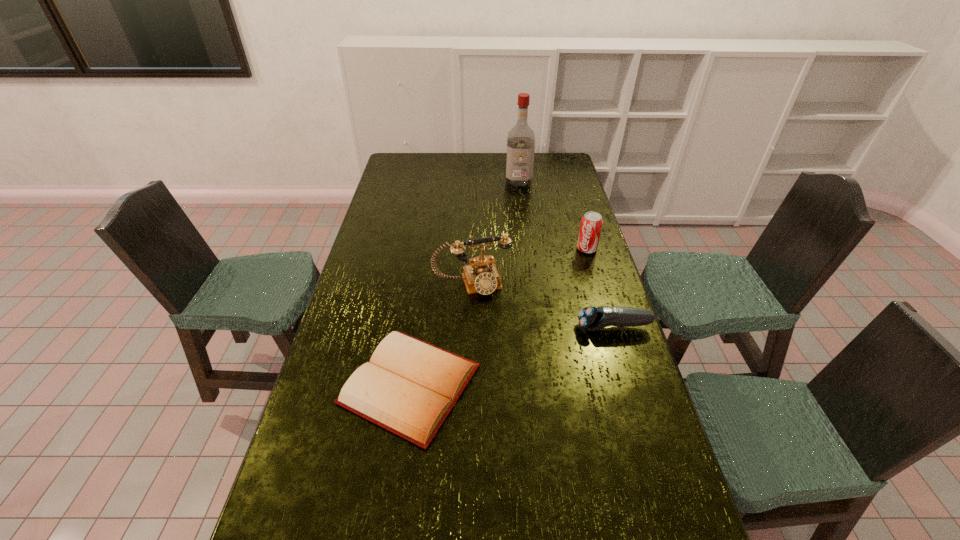
You are a GUI agent. You are given a task and a screenshot of the screen. Output one action in this format:
    pyautogui.click(x=<x>, y=<y>)
    Task: Click on the Bible
    The width and height of the screenshot is (960, 540).
    Given the screenshot: What is the action you would take?
    pyautogui.click(x=409, y=387)

The image size is (960, 540). In order to click on the second shortest object in this screenshot , I will do pyautogui.click(x=591, y=318).

At what (x,y) coordinates should I click in order to perform the action: click on the third shortest object. Please return your answer as a coordinate pair (x, y). Looking at the image, I should click on (591, 223).

In order to click on soda can in this screenshot , I will do `click(591, 223)`.

The height and width of the screenshot is (540, 960). Identify the location of the third nearest object. (481, 276).

The height and width of the screenshot is (540, 960). I want to click on the fourth shortest object, so click(481, 276).

Locate an element on the screen. liquor is located at coordinates (520, 139).

In order to click on the tallest object in this screenshot , I will do `click(520, 139)`.

What are the coordinates of `blank area located 0.050m on the back of the Bible` in the screenshot? It's located at (419, 321).

Locate an element on the screen. vacant region located on the head of the electric shaver is located at coordinates (537, 327).